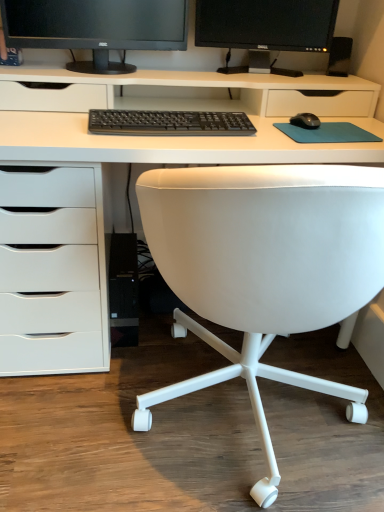
I want to click on free spot below white leather chair at center (from a real-world perspective), so [269, 431].